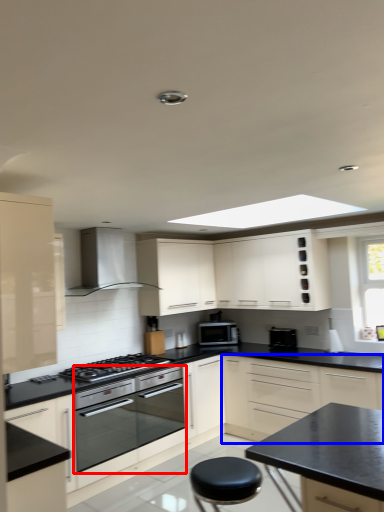
Question: Which object is closer to the camera taking this photo, oven (highlighted by a red box) or cabinetry (highlighted by a blue box)?

Choices:
 (A) oven
 (B) cabinetry

Answer: (B)